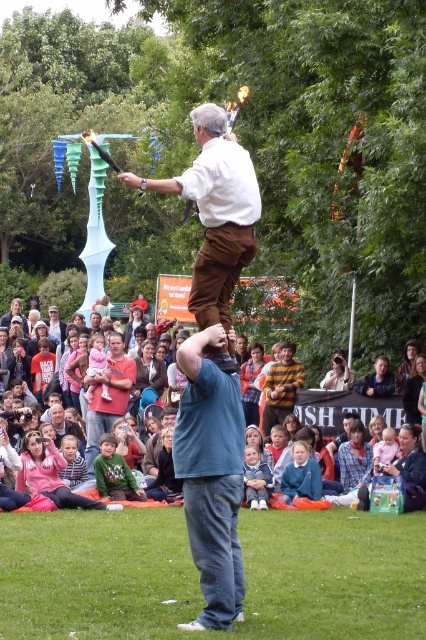
Which is above, light brown hair at center or smooth skin camera at center?

Positioned higher is smooth skin camera at center.

Can you confirm if light brown hair at center is positioned to the right of smooth skin camera at center?

Indeed, light brown hair at center is positioned on the right side of smooth skin camera at center.

Is point (356, 387) positioned before point (330, 381)?

Yes, point (356, 387) is in front of point (330, 381).

Locate an element on the screen. light brown hair at center is located at coordinates (377, 380).

Looking at this image, is matte blue fabric at center to the right of blue denim jeans at center from the viewer's perspective?

Indeed, matte blue fabric at center is positioned on the right side of blue denim jeans at center.

How distant is matte blue fabric at center from blue denim jeans at center?

9.18 meters

What are the coordinates of `matte blue fabric at center` in the screenshot? It's located at (337, 396).

Find the location of a particular element. Image resolution: width=426 pixels, height=640 pixels. matte blue fabric at center is located at coordinates (337, 396).

Is blue cotton t-shirt at center thinner than blue denim jeans at center?

No, blue cotton t-shirt at center is not thinner than blue denim jeans at center.

Can you confirm if blue cotton t-shirt at center is positioned below blue denim jeans at center?

No.

Which is behind, point (178, 355) or point (58, 406)?

Point (58, 406)

This screenshot has height=640, width=426. Identify the location of blue cotton t-shirt at center. (210, 476).